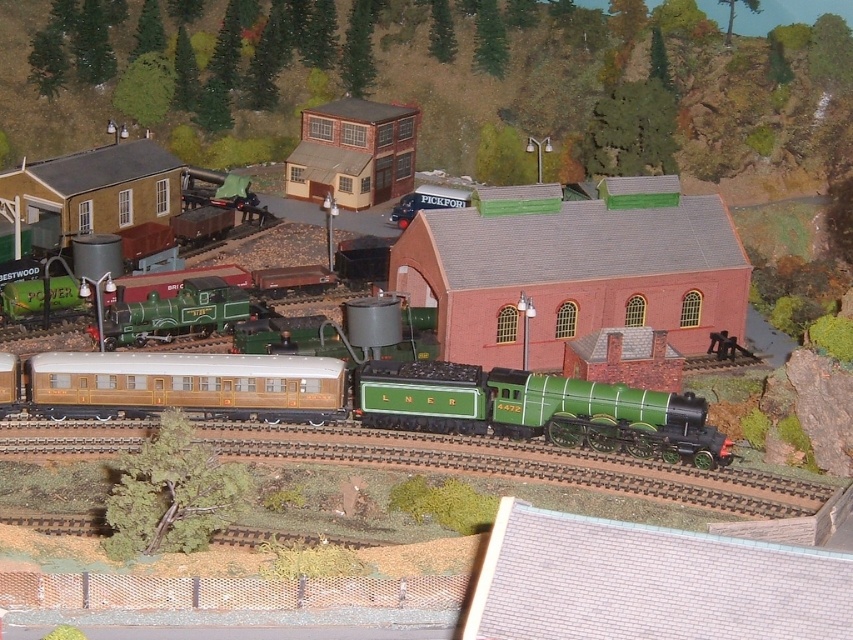
Question: Does matte green locomotive at center have a greater width compared to green metal train track at center?

Choices:
 (A) no
 (B) yes

Answer: (B)

Question: Which object is the closest to the matte gold passenger car at center?

Choices:
 (A) matte green locomotive at center
 (B) green metal train track at center

Answer: (A)

Question: Estimate the real-world distances between objects in this image. Which object is closer to the matte gold passenger car at center?

Choices:
 (A) green metal train track at center
 (B) matte green locomotive at center

Answer: (B)

Question: Which of the following is the farthest from the observer?

Choices:
 (A) (148, 412)
 (B) (573, 432)
 (C) (749, 512)

Answer: (A)

Question: From the image, what is the correct spatial relationship of green metal train track at center in relation to matte gold passenger car at center?

Choices:
 (A) right
 (B) left

Answer: (A)

Question: Does green metal train track at center lie behind matte gold passenger car at center?

Choices:
 (A) yes
 (B) no

Answer: (B)